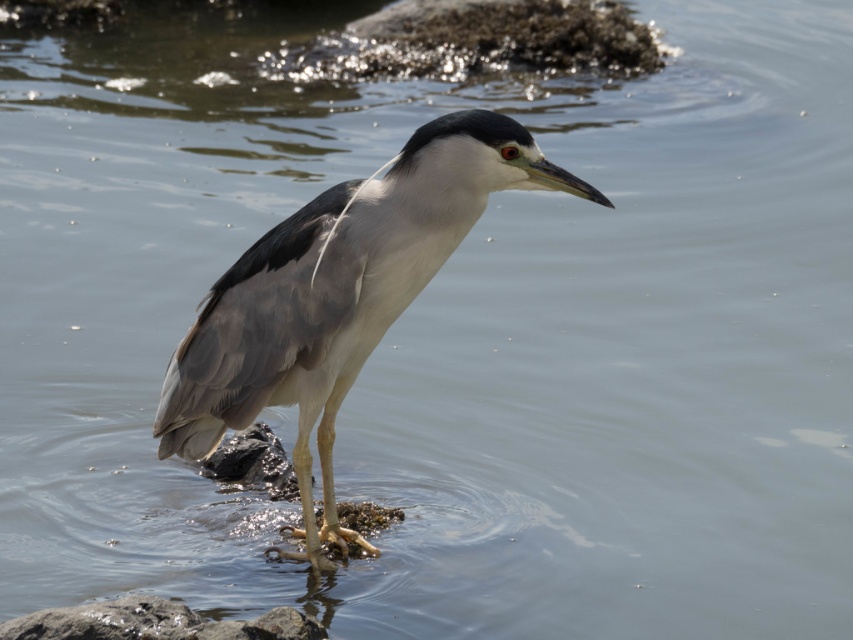
Question: Which point is closer to the camera?

Choices:
 (A) (283, 298)
 (B) (225, 637)

Answer: (B)

Question: Among these objects, which one is farthest from the camera?

Choices:
 (A) gray matte bird at center
 (B) smooth gray rock at lower left

Answer: (A)

Question: Is gray matte bird at center to the left of smooth gray rock at lower left from the viewer's perspective?

Choices:
 (A) yes
 (B) no

Answer: (B)

Question: Is gray matte bird at center thinner than smooth gray rock at lower left?

Choices:
 (A) yes
 (B) no

Answer: (B)

Question: Which point is closer to the camera taking this photo?

Choices:
 (A) (389, 243)
 (B) (45, 627)

Answer: (B)

Question: Can you confirm if gray matte bird at center is positioned to the left of smooth gray rock at lower left?

Choices:
 (A) no
 (B) yes

Answer: (A)